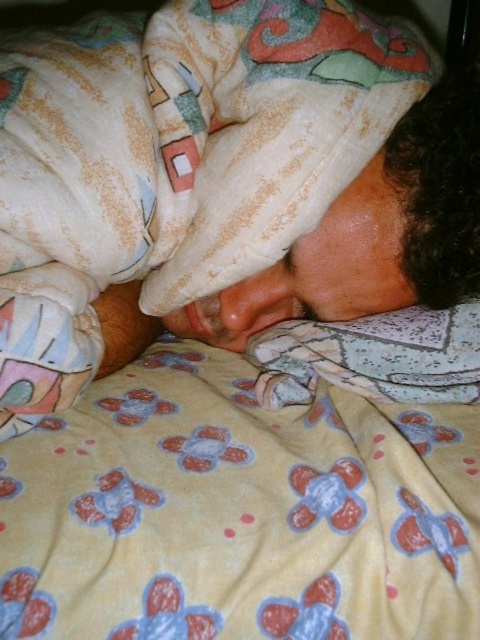
You are a photographer setting up a shot of the yellow fleece blanket at lower center and the fluffy white pillow at lower center. You want to focus on the object that is nearest to the camera. Which object should you choose?

The yellow fleece blanket at lower center is closer to the viewer than the fluffy white pillow at lower center, so you should focus on the yellow fleece blanket at lower center.

You are a caregiver checking on a patient. You notice the yellow fleece blanket at lower center and the fluffy white pillow at lower center. Which item can you use to cover the patient more effectively for warmth?

The yellow fleece blanket at lower center is bigger than the fluffy white pillow at lower center, so it can cover the patient more effectively for warmth.

You are a photographer setting up a shoot in this scene. You need to place a small lamp between the yellow fleece blanket at lower center and the fluffy white pillow at lower center. Based on their sizes, which object should the lamp be closer to?

The yellow fleece blanket at lower center is taller than the fluffy white pillow at lower center. Since the lamp needs to be placed between them, it should be closer to the fluffy white pillow at lower center to maintain balance given the height difference.